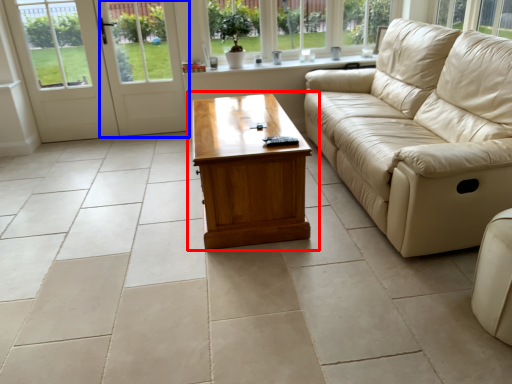
Question: Which object is further to the camera taking this photo, coffee table (highlighted by a red box) or screen door (highlighted by a blue box)?

Choices:
 (A) coffee table
 (B) screen door

Answer: (B)